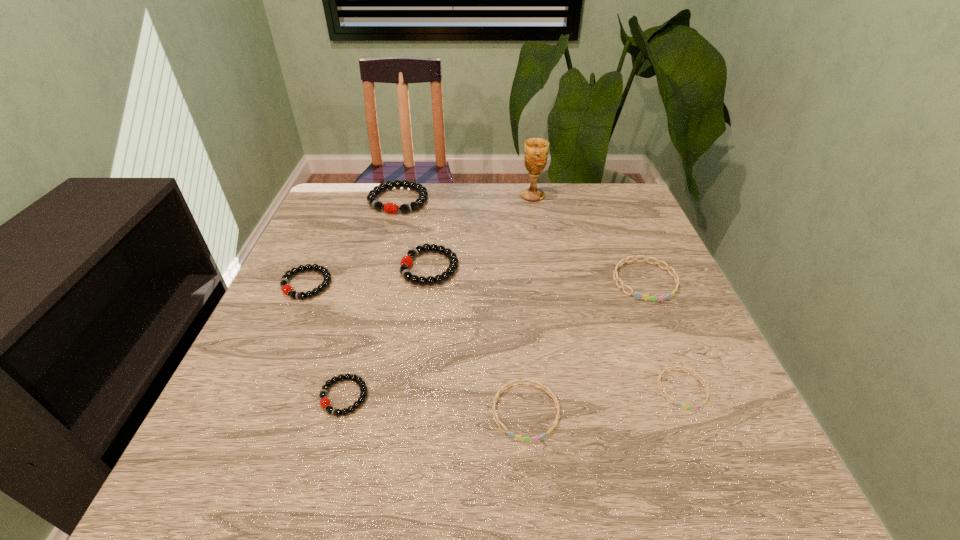
Locate an element on the screen. The width and height of the screenshot is (960, 540). the smallest blue bracelet is located at coordinates (665, 370).

The image size is (960, 540). Find the location of `the shortest bracelet`. the shortest bracelet is located at coordinates point(665,370).

Identify the location of free point located on the front of the chalice. (537, 221).

Locate an element on the screen. The height and width of the screenshot is (540, 960). vacant space situated 0.400m on the right of the farthest bracelet is located at coordinates (x=564, y=200).

The height and width of the screenshot is (540, 960). What are the coordinates of `vacant space positioned on the front of the third smallest black bracelet` in the screenshot? It's located at (411, 410).

Locate an element on the screen. This screenshot has width=960, height=540. blank space located 0.320m on the surface of the biggest blue bracelet showing star-shaped elements is located at coordinates (710, 435).

Identify the location of vacant position located 0.400m on the right of the leftmost object. The image size is (960, 540). (503, 285).

Find the location of a particular element. vacant position located on the surface of the third bracelet from right to left showing star-shaped elements is located at coordinates (531, 472).

You are a GUI agent. You are given a task and a screenshot of the screen. Output one action in this format:
    pyautogui.click(x=<x>, y=<y>)
    Task: Click on the vacant region located on the left of the smallest black bracelet
    The width and height of the screenshot is (960, 540).
    Given the screenshot: What is the action you would take?
    pyautogui.click(x=281, y=397)

The height and width of the screenshot is (540, 960). Identify the location of vacant space located 0.100m on the surface of the shortest bracelet showing star-shaped elements. (713, 465).